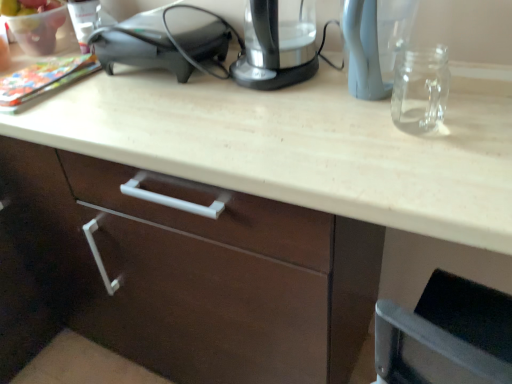
The image size is (512, 384). What do you see at coordinates (166, 41) in the screenshot? I see `satin black speaker at upper left` at bounding box center [166, 41].

The height and width of the screenshot is (384, 512). Find the location of `satin black speaker at upper left`. satin black speaker at upper left is located at coordinates (166, 41).

The width and height of the screenshot is (512, 384). What are the coordinates of `transparent plastic kettle at upper center` in the screenshot? It's located at (274, 49).

What do you see at coordinates (274, 49) in the screenshot? I see `transparent plastic kettle at upper center` at bounding box center [274, 49].

Locate an element on the screen. The width and height of the screenshot is (512, 384). satin black speaker at upper left is located at coordinates (166, 41).

Is transparent plastic kettle at upper center at the left side of satin black speaker at upper left?

Incorrect, transparent plastic kettle at upper center is not on the left side of satin black speaker at upper left.

Considering their positions, is transparent plastic kettle at upper center located in front of or behind satin black speaker at upper left?

Visually, transparent plastic kettle at upper center is located in front of satin black speaker at upper left.

Does point (280, 67) appear closer or farther from the camera than point (208, 46)?

Point (280, 67) is positioned closer to the camera compared to point (208, 46).

From the image's perspective, between transparent plastic kettle at upper center and satin black speaker at upper left, who is located below?

transparent plastic kettle at upper center, from the image's perspective.

From a real-world perspective, is transparent plastic kettle at upper center above or below satin black speaker at upper left?

transparent plastic kettle at upper center is above satin black speaker at upper left.

Which of these two, transparent plastic kettle at upper center or satin black speaker at upper left, is thinner?

With smaller width is transparent plastic kettle at upper center.

Which of these two, transparent plastic kettle at upper center or satin black speaker at upper left, stands taller?

Standing taller between the two is transparent plastic kettle at upper center.

Can you confirm if transparent plastic kettle at upper center is bigger than satin black speaker at upper left?

No.

Is transparent plastic kettle at upper center not inside satin black speaker at upper left?

Absolutely, transparent plastic kettle at upper center is external to satin black speaker at upper left.

Would you consider transparent plastic kettle at upper center to be distant from satin black speaker at upper left?

They are positioned close to each other.

Is transparent plastic kettle at upper center oriented towards satin black speaker at upper left?

No, transparent plastic kettle at upper center is not aimed at satin black speaker at upper left.

How different are the orientations of transparent plastic kettle at upper center and satin black speaker at upper left in degrees?

0.000614 degrees.

Could you measure the distance between transparent plastic kettle at upper center and satin black speaker at upper left?

A distance of 6.73 inches exists between transparent plastic kettle at upper center and satin black speaker at upper left.

In the image, there is a transparent plastic kettle at upper center. Identify the location of appliance below it (from a real-world perspective). (166, 41).

Which object is positioned more to the left, satin black speaker at upper left or transparent plastic kettle at upper center?

satin black speaker at upper left.

Is satin black speaker at upper left positioned behind transparent plastic kettle at upper center?

That is True.

Is point (165, 14) positioned behind point (272, 81)?

Yes, point (165, 14) is farther from viewer.

From the image's perspective, is satin black speaker at upper left positioned above or below transparent plastic kettle at upper center?

satin black speaker at upper left is above transparent plastic kettle at upper center.

From a real-world perspective, is satin black speaker at upper left on transparent plastic kettle at upper center?

Incorrect, from a real-world perspective, satin black speaker at upper left is lower than transparent plastic kettle at upper center.

Between satin black speaker at upper left and transparent plastic kettle at upper center, which one has larger width?

Wider between the two is satin black speaker at upper left.

Considering the sizes of objects satin black speaker at upper left and transparent plastic kettle at upper center in the image provided, who is taller, satin black speaker at upper left or transparent plastic kettle at upper center?

With more height is transparent plastic kettle at upper center.

Between satin black speaker at upper left and transparent plastic kettle at upper center, which one has larger size?

satin black speaker at upper left.

Is satin black speaker at upper left spatially inside transparent plastic kettle at upper center, or outside of it?

The correct answer is: outside.

Would you say satin black speaker at upper left is a long distance from transparent plastic kettle at upper center?

No, satin black speaker at upper left is not far from transparent plastic kettle at upper center.

Could you tell me if satin black speaker at upper left is turned towards transparent plastic kettle at upper center?

No, satin black speaker at upper left is not facing towards transparent plastic kettle at upper center.

Locate an element on the screen. The width and height of the screenshot is (512, 384). appliance below the transparent plastic kettle at upper center (from a real-world perspective) is located at coordinates (166, 41).

You are a GUI agent. You are given a task and a screenshot of the screen. Output one action in this format:
    pyautogui.click(x=<x>, y=<y>)
    Task: Click on the home appliance in front of the satin black speaker at upper left
    The image size is (512, 384).
    Given the screenshot: What is the action you would take?
    pyautogui.click(x=274, y=49)

Where is `appliance on the left of the transparent plastic kettle at upper center`? appliance on the left of the transparent plastic kettle at upper center is located at coordinates (166, 41).